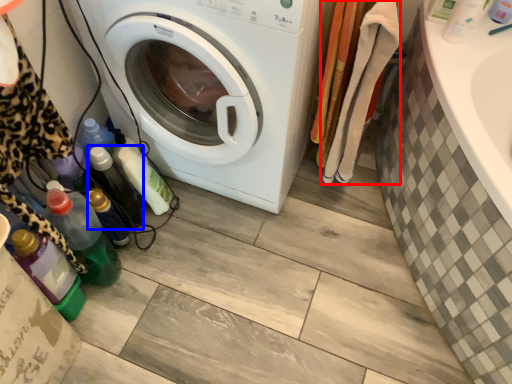
Question: Which of the following is the farthest to the observer, clothing (highlighted by a red box) or bottle (highlighted by a blue box)?

Choices:
 (A) clothing
 (B) bottle

Answer: (B)